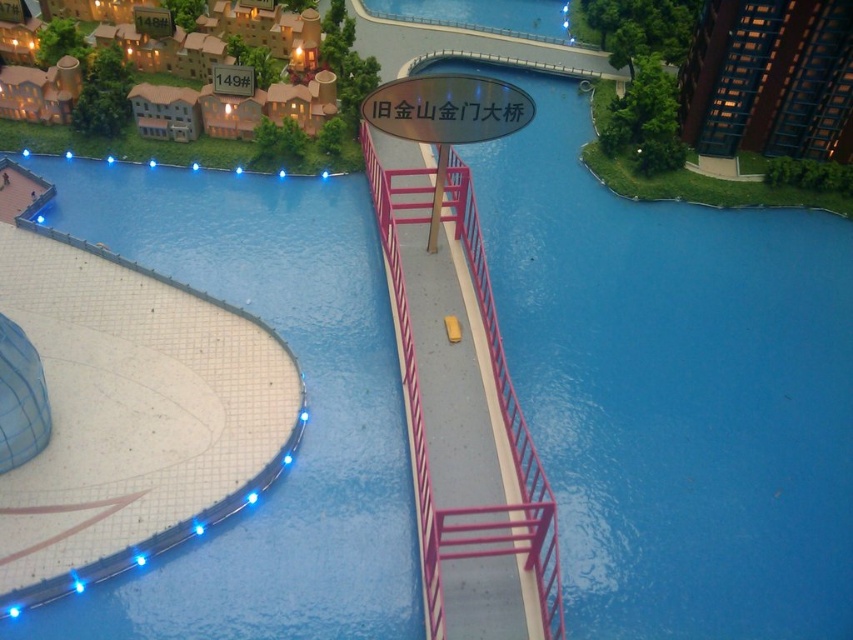
Question: Considering the relative positions of blue glossy water at center and blue glossy pool at lower left in the image provided, where is blue glossy water at center located with respect to blue glossy pool at lower left?

Choices:
 (A) right
 (B) left

Answer: (A)

Question: Does metallic pink railing at center have a greater width compared to glassy blue skyscraper at upper right?

Choices:
 (A) no
 (B) yes

Answer: (A)

Question: Is blue glossy pool at lower left to the left of metallic pink railing at center from the viewer's perspective?

Choices:
 (A) yes
 (B) no

Answer: (A)

Question: Considering the real-world distances, which object is closest to the blue glossy water at center?

Choices:
 (A) metallic pink railing at center
 (B) blue glossy pool at lower left

Answer: (A)

Question: Which object appears closest to the camera in this image?

Choices:
 (A) blue glossy water at center
 (B) blue glossy pool at lower left
 (C) glassy blue skyscraper at upper right

Answer: (B)

Question: Which of the following is the farthest from the observer?

Choices:
 (A) blue glossy water at center
 (B) metallic pink railing at center

Answer: (A)